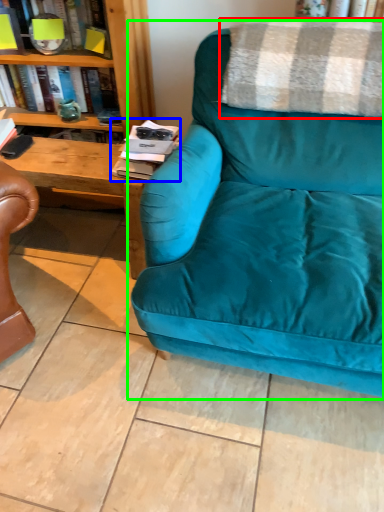
Question: Which object is the closest to the blanket (highlighted by a red box)? Choose among these: magazine (highlighted by a blue box) or studio couch (highlighted by a green box).

Choices:
 (A) magazine
 (B) studio couch

Answer: (B)